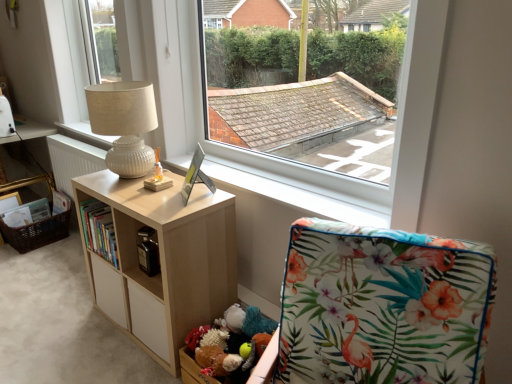
In order to click on free spot below transparent glass window at upper center, acting as the first window starting from the front (from a real-world perspective) in this screenshot , I will do `click(285, 186)`.